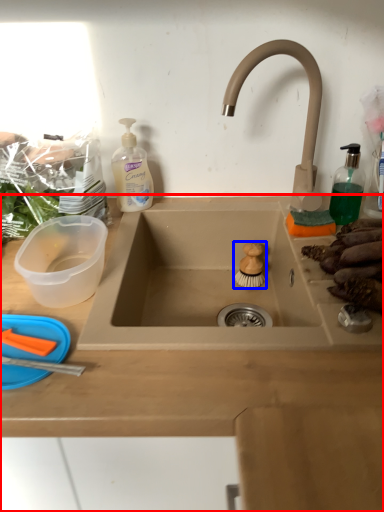
Question: Which object appears farthest to the camera in this image, countertop (highlighted by a red box) or food (highlighted by a blue box)?

Choices:
 (A) countertop
 (B) food

Answer: (B)